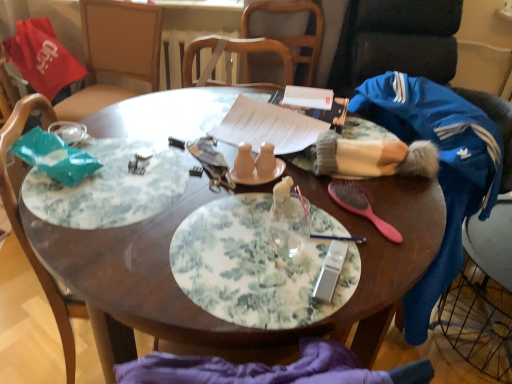
I want to click on free space in front of matte ceramic salt and pepper shakers at center, which is the first tableware in left-to-right order, so click(x=237, y=221).